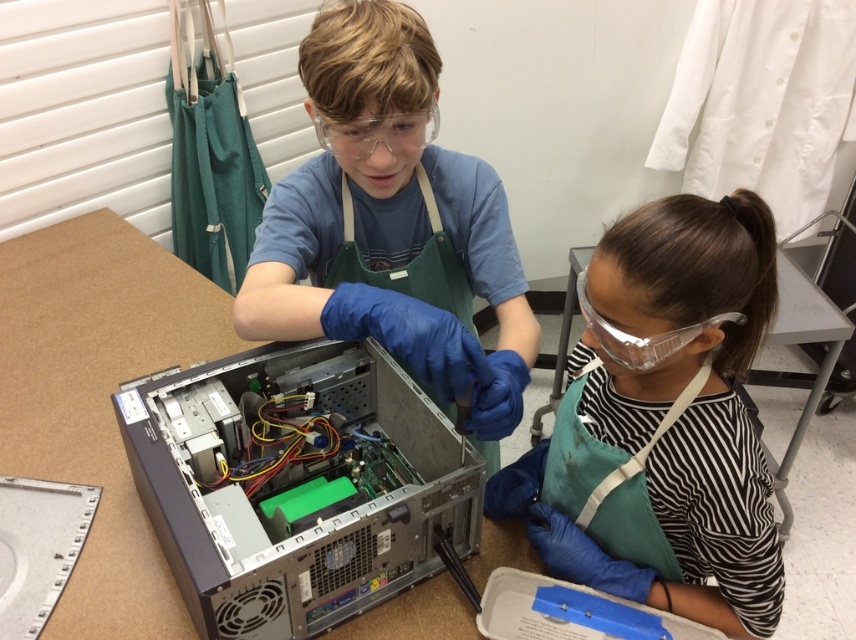
Is clear plastic goggles at center bigger than clear plastic goggles at upper center?

Incorrect, clear plastic goggles at center is not larger than clear plastic goggles at upper center.

Between clear plastic goggles at center and clear plastic goggles at upper center, which one is positioned lower?

clear plastic goggles at upper center is lower down.

Where is `clear plastic goggles at center`? The image size is (856, 640). clear plastic goggles at center is located at coordinates (378, 132).

The image size is (856, 640). I want to click on clear plastic goggles at center, so click(378, 132).

Is silver metallic computer case at center to the right of matte blue shirt at center from the viewer's perspective?

No, silver metallic computer case at center is not to the right of matte blue shirt at center.

Consider the image. Is silver metallic computer case at center smaller than matte blue shirt at center?

Correct, silver metallic computer case at center occupies less space than matte blue shirt at center.

The width and height of the screenshot is (856, 640). I want to click on silver metallic computer case at center, so click(296, 486).

Who is higher up, matte blue shirt at center or clear plastic goggles at center?

clear plastic goggles at center

Can you confirm if matte blue shirt at center is wider than clear plastic goggles at center?

Yes.

You are a GUI agent. You are given a task and a screenshot of the screen. Output one action in this format:
    pyautogui.click(x=<x>, y=<y>)
    Task: Click on the matte blue shirt at center
    The image size is (856, 640).
    Given the screenshot: What is the action you would take?
    pyautogui.click(x=391, y=224)